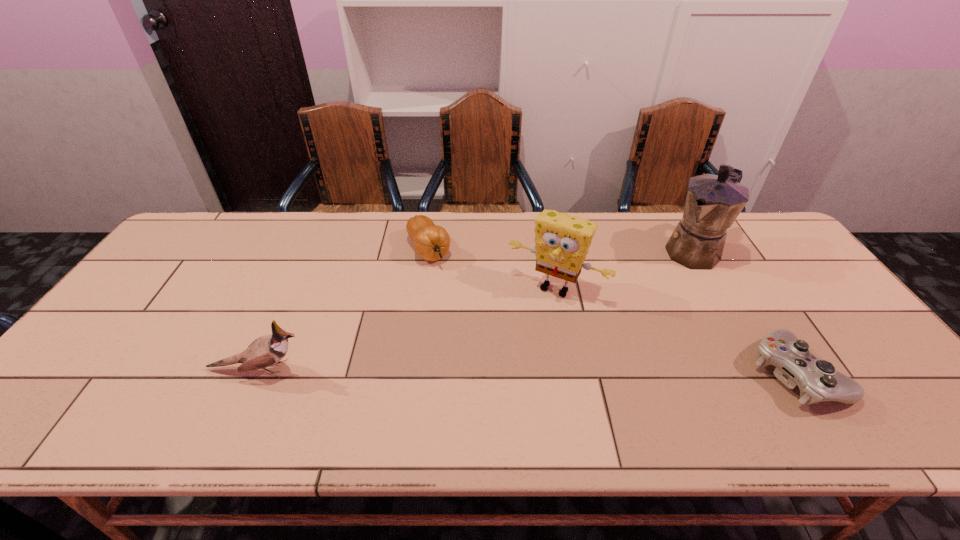
The image size is (960, 540). Find the location of `vacant space on the desktop that is between the bird and the control and is positioned on the face of the third object from left to right`. vacant space on the desktop that is between the bird and the control and is positioned on the face of the third object from left to right is located at coordinates (507, 371).

Identify the location of vacant spot on the desktop that is between the leftmost object and the control and is positioned on the stem side of the fourth object from right to left. (511, 371).

This screenshot has width=960, height=540. I want to click on vacant space on the desktop that is between the bird and the control and is positioned on the pouring side of the coffeepot, so click(564, 372).